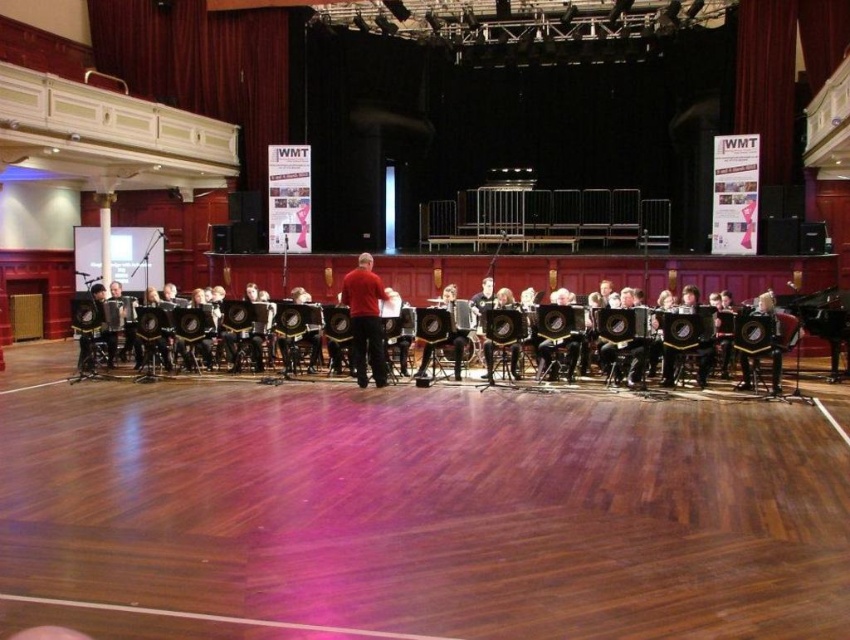
You are standing at the entrance of the hall and want to walk towards the wooden floor at center. Which direction should you move?

Since the wooden floor at center is located at point (414, 512), you should move forward towards the center of the hall to reach it.

You are a photographer positioned at the front of the hall. You want to take a photo of two points in the scene, point 1 at coordinates point (418,573) and point 2 at coordinates point (375,323). Which point will appear larger in your photo?

Point 1 at coordinates point (418,573) will appear larger in the photo because it is closer to the camera than point 2 at coordinates point (375,323).